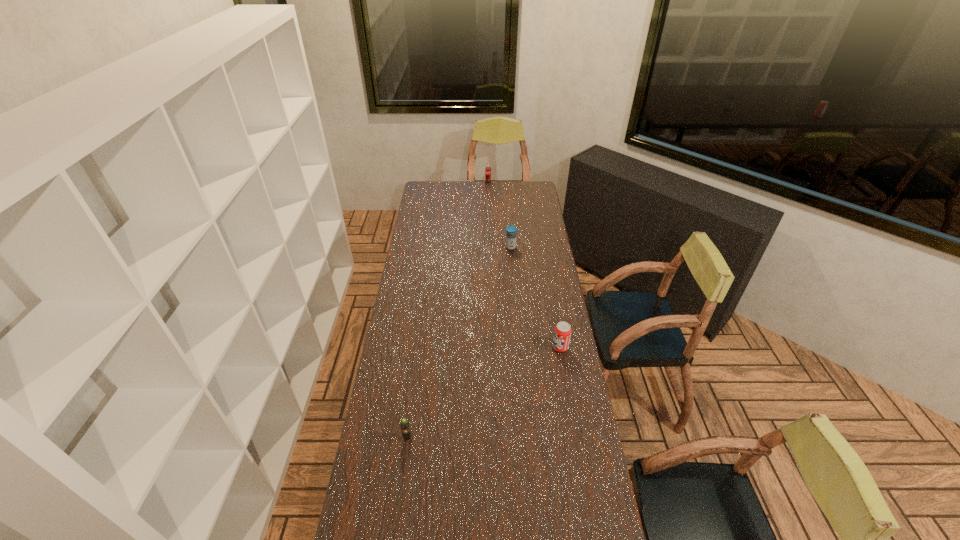
Image resolution: width=960 pixels, height=540 pixels. Identify the location of empty space between the second farthest object and the second farthest soda. (536, 298).

The height and width of the screenshot is (540, 960). Find the location of `free area in between the medicine and the second nearest object`. free area in between the medicine and the second nearest object is located at coordinates (536, 298).

The width and height of the screenshot is (960, 540). What are the coordinates of `vacant point located between the second nearest object and the nearest soda` in the screenshot? It's located at (484, 393).

Locate an element on the screen. The image size is (960, 540). vacant space in between the leftmost soda and the rightmost object is located at coordinates (484, 393).

Locate an element on the screen. The width and height of the screenshot is (960, 540). unoccupied area between the tallest object and the rightmost object is located at coordinates (524, 265).

Locate an element on the screen. empty space between the rightmost object and the tallest soda is located at coordinates (524, 265).

Where is `empty space that is in between the rightmost object and the medicine`? The height and width of the screenshot is (540, 960). empty space that is in between the rightmost object and the medicine is located at coordinates (536, 298).

At what (x,y) coordinates should I click in order to perform the action: click on vacant area that lies between the second farthest object and the leftmost soda. Please return your answer as a coordinate pair (x, y). The image size is (960, 540). Looking at the image, I should click on (459, 343).

At what (x,y) coordinates should I click in order to perform the action: click on unoccupied area between the nearest object and the rightmost object. Please return your answer as a coordinate pair (x, y). Image resolution: width=960 pixels, height=540 pixels. Looking at the image, I should click on (484, 393).

The width and height of the screenshot is (960, 540). Identify the location of vacant area that lies between the leftmost object and the tallest soda. (447, 310).